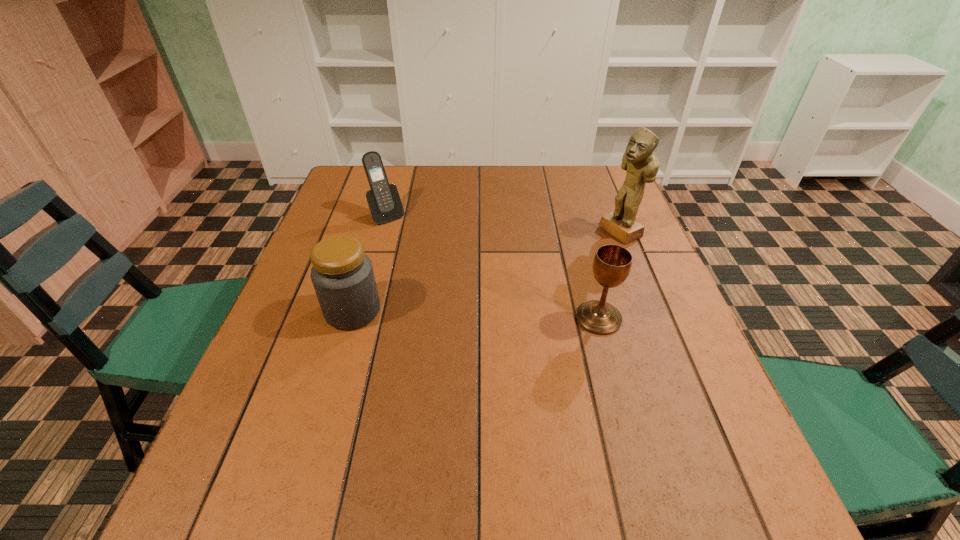
You are a GUI agent. You are given a task and a screenshot of the screen. Output one action in this format:
    pyautogui.click(x=<x>, y=<y>)
    Task: Click on the vacant space situated on the front-facing side of the figurine
    
    Given the screenshot: What is the action you would take?
    504,291

Where is `free space located on the front-facing side of the figurine`? free space located on the front-facing side of the figurine is located at coordinates (588, 248).

The image size is (960, 540). I want to click on free location located 0.070m on the front-facing side of the figurine, so click(x=588, y=248).

Find the location of a particular element. The image size is (960, 540). object located at the far edge is located at coordinates (384, 202).

What are the coordinates of `jar present at the left edge` in the screenshot? It's located at (342, 274).

This screenshot has width=960, height=540. What are the coordinates of `cellular telephone that is positioned at the left edge` in the screenshot? It's located at (384, 202).

Where is `chalice at the right edge`? This screenshot has height=540, width=960. chalice at the right edge is located at coordinates [612, 263].

The width and height of the screenshot is (960, 540). I want to click on figurine that is at the right edge, so click(639, 160).

I want to click on object that is at the far left corner, so click(384, 202).

Image resolution: width=960 pixels, height=540 pixels. In order to click on vacant region at the far edge of the desktop in this screenshot , I will do `click(519, 202)`.